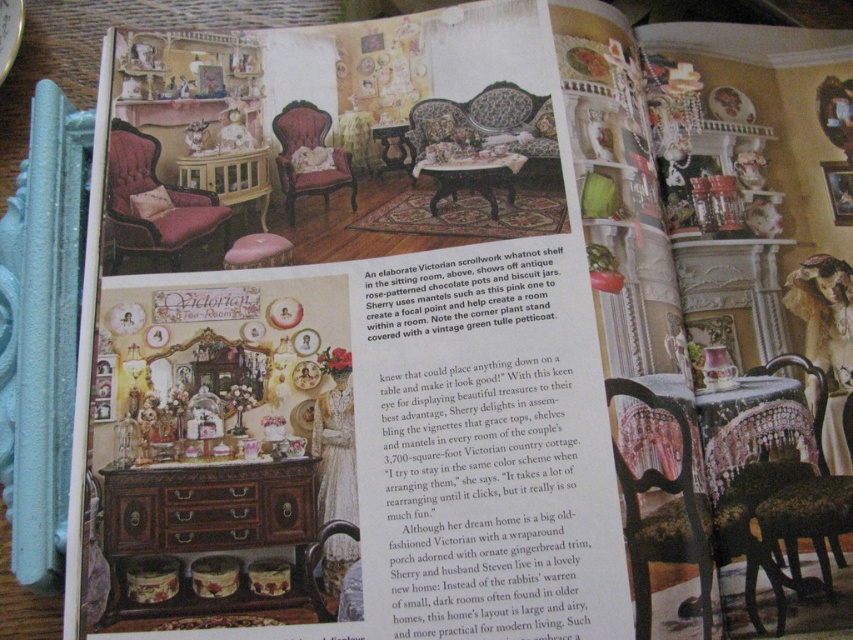
Can you confirm if matte pink fabric armchair at upper left is smaller than floral-patterned fabric sofa at center?

Actually, matte pink fabric armchair at upper left might be larger than floral-patterned fabric sofa at center.

Is point (125, 163) positioned after point (521, 136)?

Yes, point (125, 163) is behind point (521, 136).

Identify the location of matte pink fabric armchair at upper left. Image resolution: width=853 pixels, height=640 pixels. (155, 205).

Looking at this image, is matte pink fabric armchair at upper left to the left of wooden table at center from the viewer's perspective?

Yes, matte pink fabric armchair at upper left is to the left of wooden table at center.

Consider the image. Which is more to the left, matte pink fabric armchair at upper left or wooden table at center?

matte pink fabric armchair at upper left

Is point (183, 250) positioned after point (474, 156)?

No, it is in front of (474, 156).

Image resolution: width=853 pixels, height=640 pixels. What are the coordinates of `matte pink fabric armchair at upper left` in the screenshot? It's located at (155, 205).

Between matte pink fabric armchair at upper left and matte wood table at center, which one is positioned lower?

matte pink fabric armchair at upper left

Does matte pink fabric armchair at upper left appear on the right side of matte wood table at center?

No, matte pink fabric armchair at upper left is not to the right of matte wood table at center.

Does point (173, 228) lie behind point (210, 180)?

No, it is not.

Identify the location of matte pink fabric armchair at upper left. (155, 205).